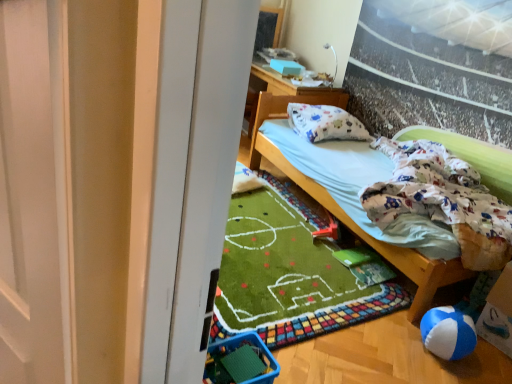
Question: Is white cotton pillow at upper center surrounding white cotton mattress at center?

Choices:
 (A) yes
 (B) no

Answer: (B)

Question: Is white cotton pillow at upper center touching white cotton mattress at center?

Choices:
 (A) no
 (B) yes

Answer: (A)

Question: Considering the relative positions of white cotton pillow at upper center and white cotton mattress at center in the image provided, is white cotton pillow at upper center to the left of white cotton mattress at center from the viewer's perspective?

Choices:
 (A) no
 (B) yes

Answer: (B)

Question: From the image's perspective, does white cotton pillow at upper center appear lower than white cotton mattress at center?

Choices:
 (A) no
 (B) yes

Answer: (A)

Question: Is white cotton pillow at upper center smaller than white cotton mattress at center?

Choices:
 (A) no
 (B) yes

Answer: (B)

Question: Is blue plastic baby carriage at lower left in front of or behind white cotton pillow at upper center in the image?

Choices:
 (A) behind
 (B) front

Answer: (B)

Question: In the image, is blue plastic baby carriage at lower left on the left side or the right side of white cotton pillow at upper center?

Choices:
 (A) right
 (B) left

Answer: (B)

Question: Considering the positions of blue plastic baby carriage at lower left and white cotton pillow at upper center in the image, is blue plastic baby carriage at lower left wider or thinner than white cotton pillow at upper center?

Choices:
 (A) wide
 (B) thin

Answer: (B)

Question: Is blue plastic baby carriage at lower left taller or shorter than white cotton pillow at upper center?

Choices:
 (A) tall
 (B) short

Answer: (B)

Question: From a real-world perspective, is white cotton pillow at upper center positioned above or below blue plastic baby carriage at lower left?

Choices:
 (A) above
 (B) below

Answer: (A)

Question: Is white cotton pillow at upper center to the left or to the right of blue plastic baby carriage at lower left in the image?

Choices:
 (A) left
 (B) right

Answer: (B)

Question: Is white cotton pillow at upper center wider or thinner than blue plastic baby carriage at lower left?

Choices:
 (A) wide
 (B) thin

Answer: (A)

Question: Relative to blue plastic baby carriage at lower left, is white cotton pillow at upper center in front or behind?

Choices:
 (A) behind
 (B) front

Answer: (A)

Question: Looking at the image, does white fabric pillow at upper center seem bigger or smaller compared to red plastic toy at lower center?

Choices:
 (A) small
 (B) big

Answer: (B)

Question: Is point (282, 107) closer or farther from the camera than point (335, 223)?

Choices:
 (A) closer
 (B) farther

Answer: (B)